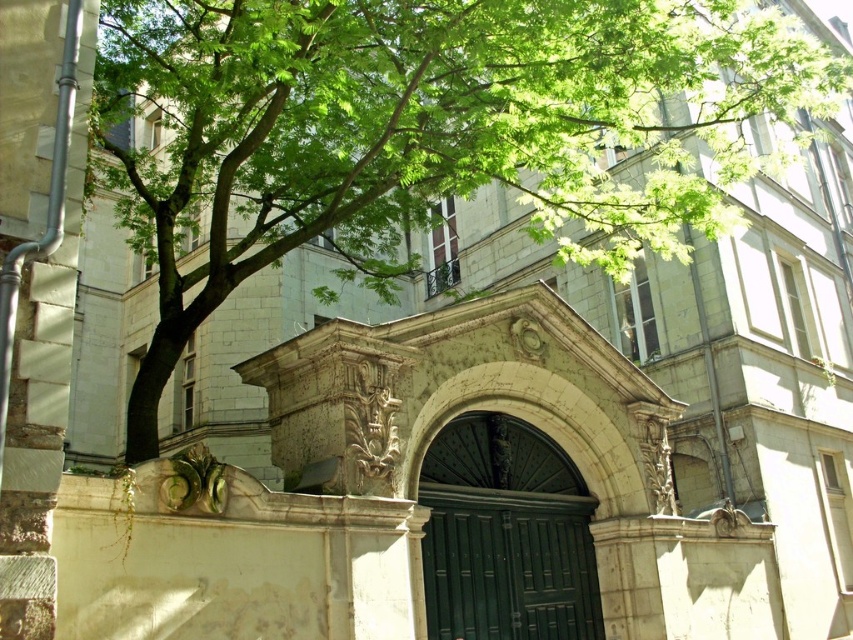
Is green leafy tree at center taller than green polished wood door at center?

Yes, green leafy tree at center is taller than green polished wood door at center.

Can you confirm if green leafy tree at center is bigger than green polished wood door at center?

Correct, green leafy tree at center is larger in size than green polished wood door at center.

The width and height of the screenshot is (853, 640). Find the location of `green leafy tree at center`. green leafy tree at center is located at coordinates (421, 131).